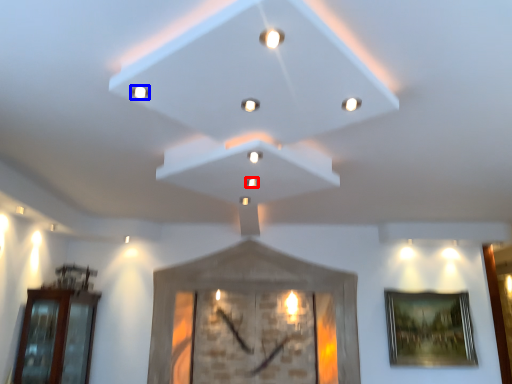
Question: Which of the following is the farthest to the observer, light (highlighted by a red box) or light (highlighted by a blue box)?

Choices:
 (A) light
 (B) light

Answer: (A)